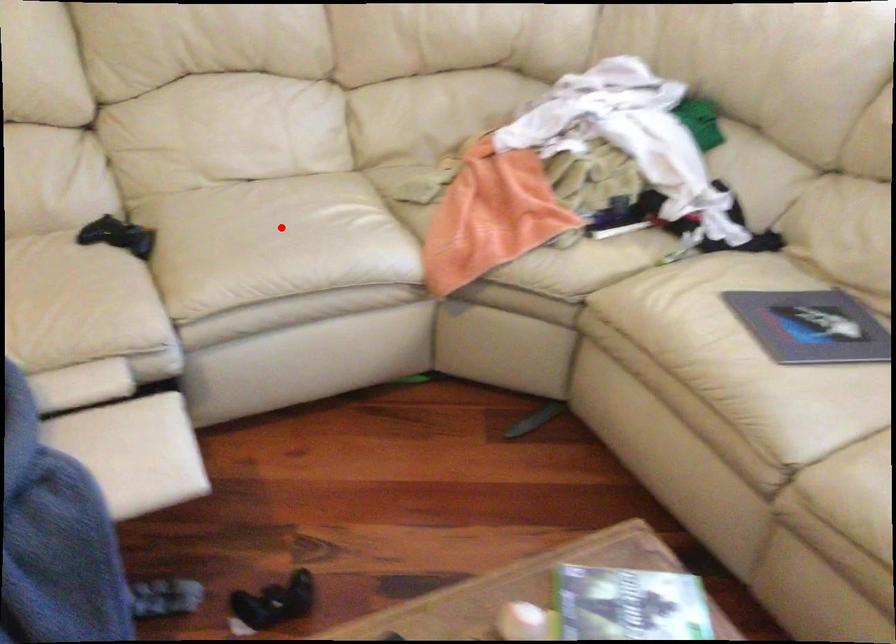
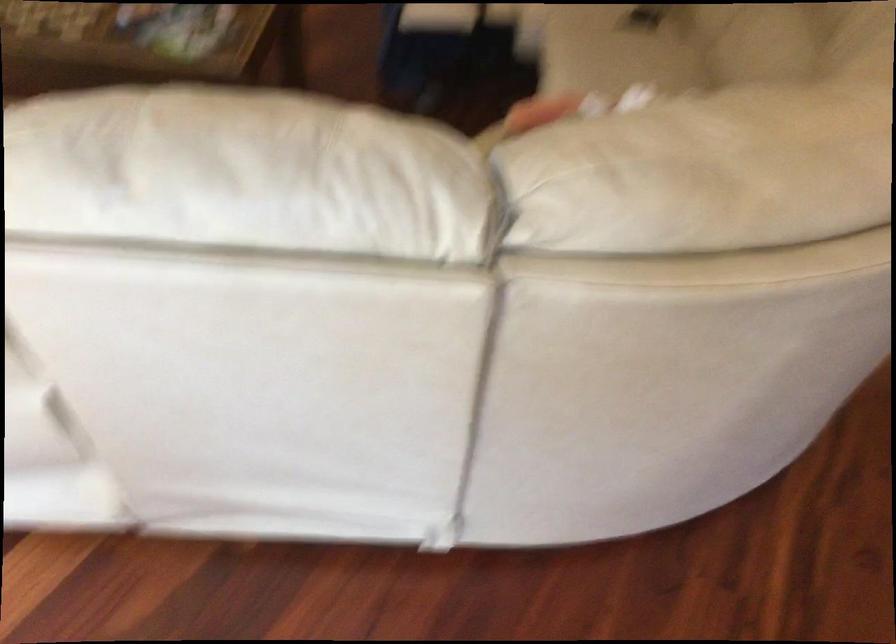
Question: I am providing you with two images of the same scene from different viewpoints. Image1 has a red point marked. In image2, the corresponding 3D location appears at what relative position? Reply with the corresponding letter.

Choices:
 (A) Closer
 (B) Farther

Answer: (B)